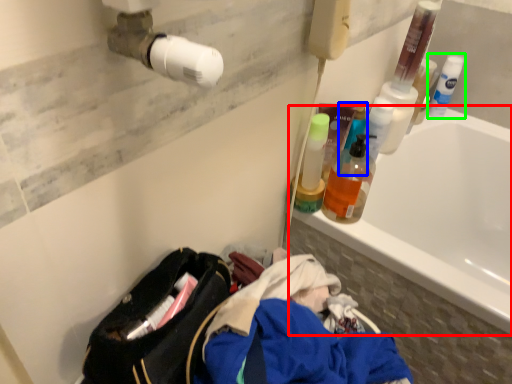
Question: Based on their relative distances, which object is farther from bathtub (highlighted by a red box)? Choose from cleaning product (highlighted by a blue box) and cleaning product (highlighted by a green box).

Choices:
 (A) cleaning product
 (B) cleaning product

Answer: (A)